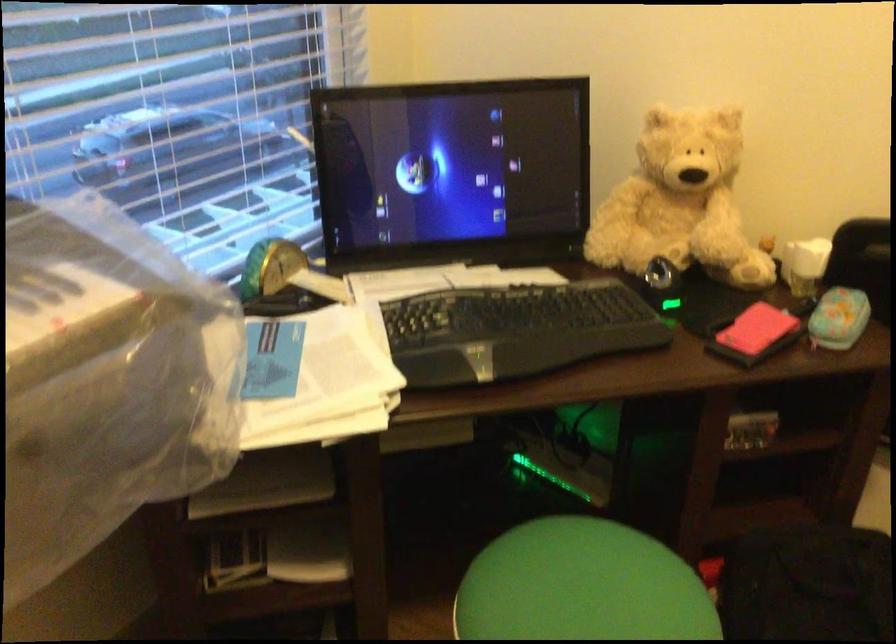
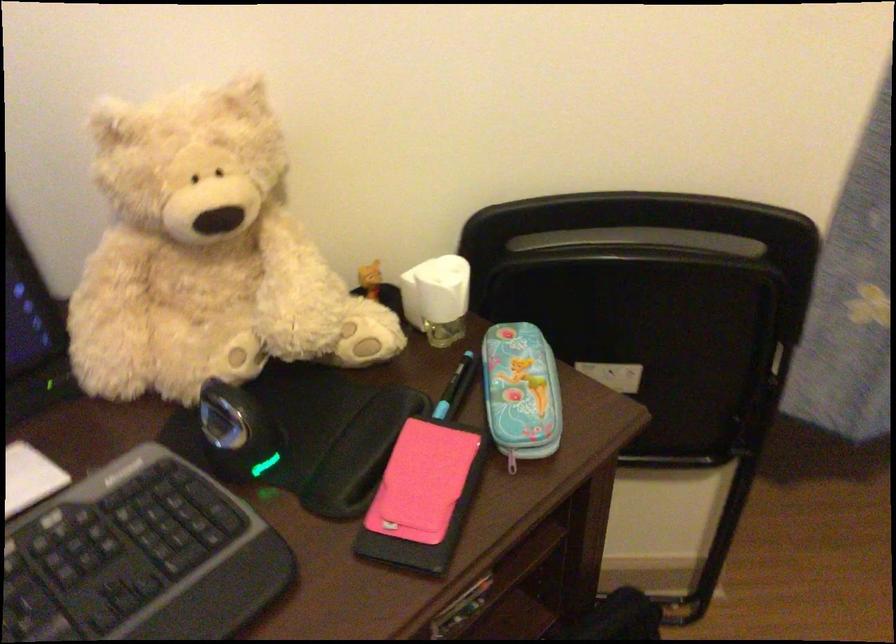
Find the pixel in the second image that matches [674,193] in the first image.

(205, 254)